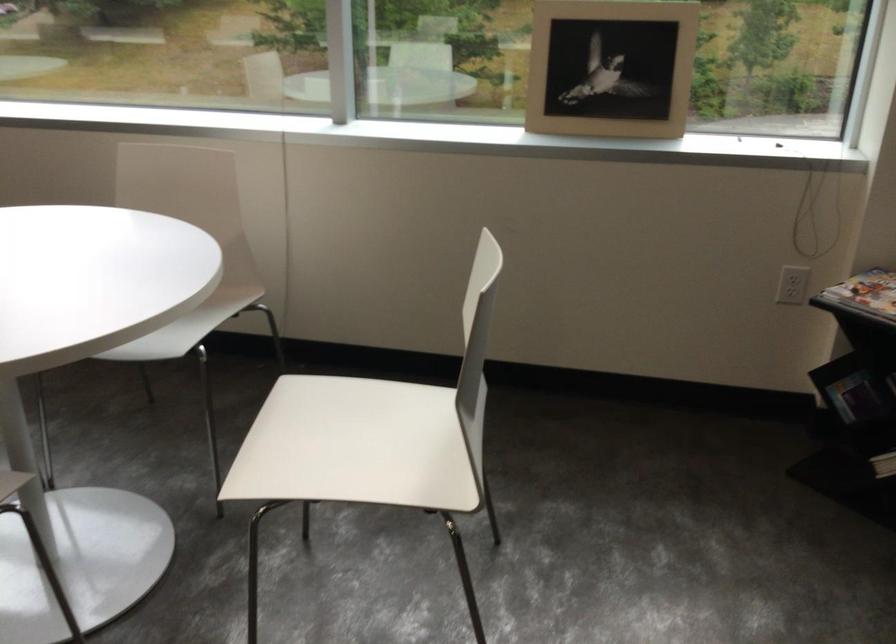
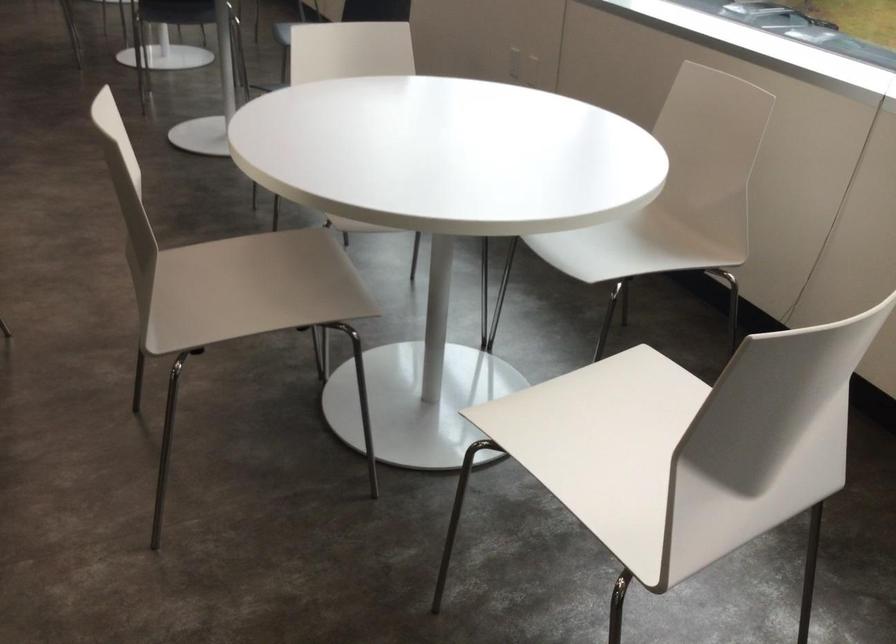
In the second image, find the point that corresponds to [349,448] in the first image.

(604, 444)